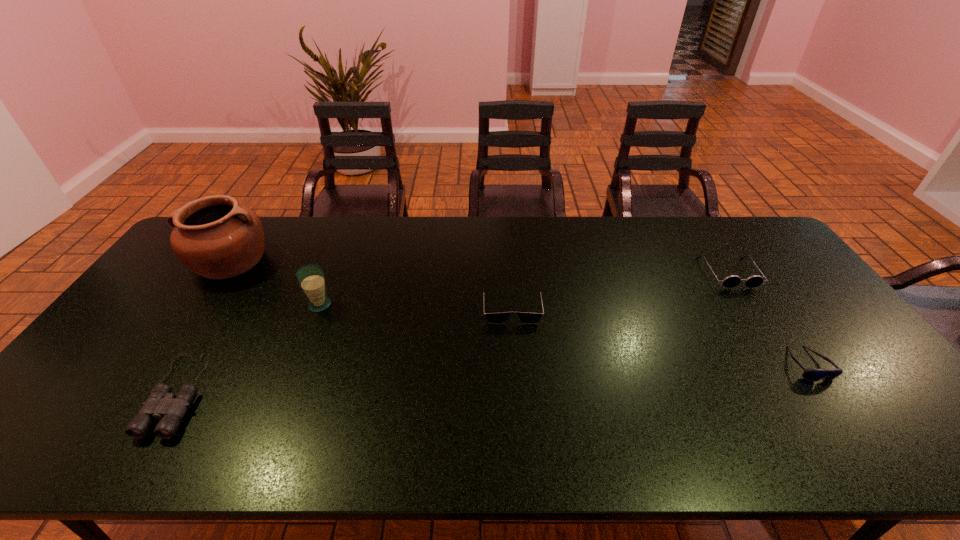
Locate which object ranks third in proximity to the second tallest object. Please provide its 2D coordinates. Your answer should be formatted as a tuple, i.e. [(x, y)], where the tuple contains the x and y coordinates of a point satisfying the conditions above.

[(492, 318)]

This screenshot has height=540, width=960. Identify the location of the third closest object to the pottery. (492, 318).

Choose which sunglasses is the second nearest neighbor to the fourth object from right to left. Please provide its 2D coordinates. Your answer should be formatted as a tuple, i.e. [(x, y)], where the tuple contains the x and y coordinates of a point satisfying the conditions above.

[(731, 281)]

Image resolution: width=960 pixels, height=540 pixels. Identify the location of sunglasses that is the nearest to the second tallest object. (492, 318).